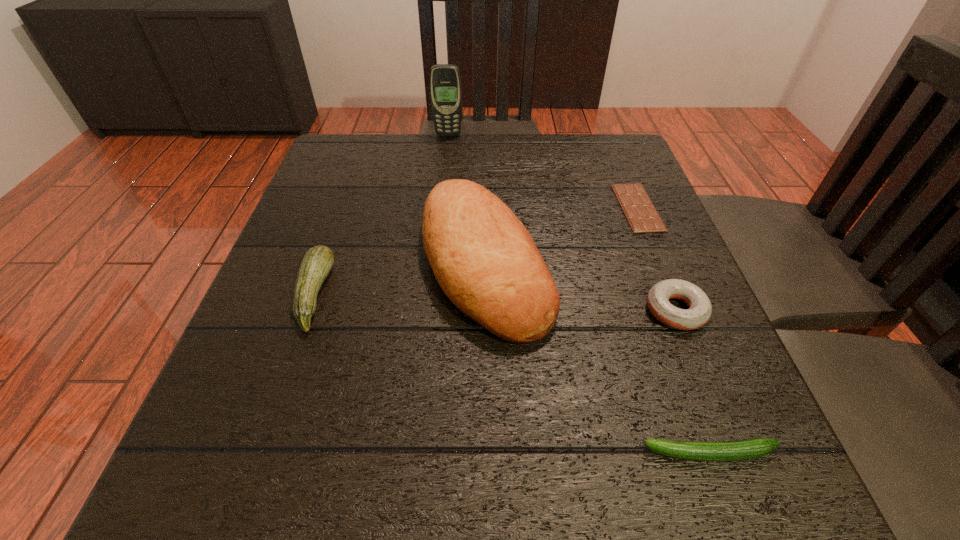
The height and width of the screenshot is (540, 960). Identify the location of free area in between the chocolate bar and the farthest object. (543, 171).

Where is `unoccupied area between the third shortest object and the chocolate bar`? The width and height of the screenshot is (960, 540). unoccupied area between the third shortest object and the chocolate bar is located at coordinates (657, 259).

Identify which object is the fourth nearest to the left zucchini. Please provide its 2D coordinates. Your answer should be formatted as a tuple, i.e. [(x, y)], where the tuple contains the x and y coordinates of a point satisfying the conditions above.

[(700, 308)]

You are a GUI agent. You are given a task and a screenshot of the screen. Output one action in this format:
    pyautogui.click(x=<x>, y=<y>)
    Task: Click on the object that stands as the second closest to the third shortest object
    This screenshot has width=960, height=540.
    Given the screenshot: What is the action you would take?
    click(x=484, y=259)

Identify the location of blank area in the image that satisfies the following two spatial constraints: 1. on the front side of the shortest object; 2. on the front-facing side of the nearest object. This screenshot has width=960, height=540. (737, 453).

Image resolution: width=960 pixels, height=540 pixels. In order to click on free space that satisfies the following two spatial constraints: 1. on the screen of the farthest object; 2. on the left side of the second tallest object in this screenshot , I will do `click(436, 264)`.

This screenshot has height=540, width=960. Find the location of `vacant space that satisfies the following two spatial constraints: 1. on the back side of the doughnut; 2. at the stem end of the fourth shortest object`. vacant space that satisfies the following two spatial constraints: 1. on the back side of the doughnut; 2. at the stem end of the fourth shortest object is located at coordinates (669, 295).

I want to click on free space that satisfies the following two spatial constraints: 1. on the screen of the tallest object; 2. on the right side of the shortest object, so click(x=441, y=207).

Locate an element on the screen. The height and width of the screenshot is (540, 960). vacant space that satisfies the following two spatial constraints: 1. on the screen of the doughnut; 2. on the right side of the cellular telephone is located at coordinates (431, 310).

Where is `free space that satisfies the following two spatial constraints: 1. at the stem end of the doughnut; 2. on the left side of the taller zucchini`? The width and height of the screenshot is (960, 540). free space that satisfies the following two spatial constraints: 1. at the stem end of the doughnut; 2. on the left side of the taller zucchini is located at coordinates (308, 310).